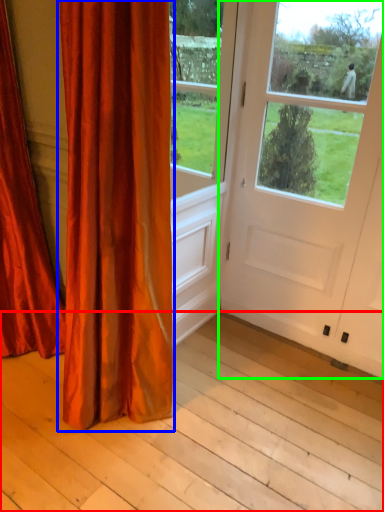
Question: Based on their relative distances, which object is nearer to plank (highlighted by a red box)? Choose from curtain (highlighted by a blue box) and door (highlighted by a green box).

Choices:
 (A) curtain
 (B) door

Answer: (A)